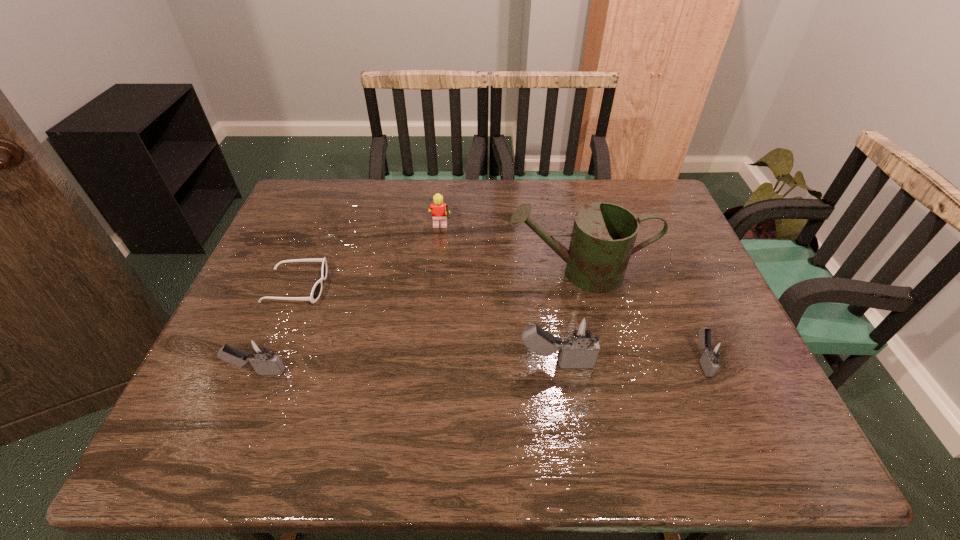
Find the location of a particular element. The height and width of the screenshot is (540, 960). unoccupied position between the tallest object and the fourth object from right to left is located at coordinates (510, 251).

Find the location of a particular element. Image resolution: width=960 pixels, height=540 pixels. free space between the third object from left to right and the tallest igniter is located at coordinates (498, 296).

This screenshot has height=540, width=960. I want to click on vacant area between the farthest object and the sunglasses, so click(x=369, y=258).

Where is `empty location between the second igniter from left to right and the farthest object`? empty location between the second igniter from left to right and the farthest object is located at coordinates click(498, 296).

Identify the location of vacant point located between the rightmost igniter and the tallest object. (640, 316).

Image resolution: width=960 pixels, height=540 pixels. Find the location of `vacant point located between the leftmost igniter and the sunglasses`. vacant point located between the leftmost igniter and the sunglasses is located at coordinates (277, 329).

At what (x,y) coordinates should I click in order to perform the action: click on vacant point located between the rightmost object and the fifth shortest object. Please return your answer as a coordinate pair (x, y). This screenshot has height=540, width=960. Looking at the image, I should click on (629, 362).

What are the coordinates of `blank region between the Lego and the second shortest igniter` in the screenshot? It's located at (349, 301).

At what (x,y) coordinates should I click in order to perform the action: click on free space between the tallest igniter and the leftmost igniter. Please return your answer as a coordinate pair (x, y). This screenshot has height=540, width=960. Looking at the image, I should click on (407, 368).

Locate an element on the screen. The width and height of the screenshot is (960, 540). free space between the third object from left to right and the leftmost igniter is located at coordinates (349, 301).